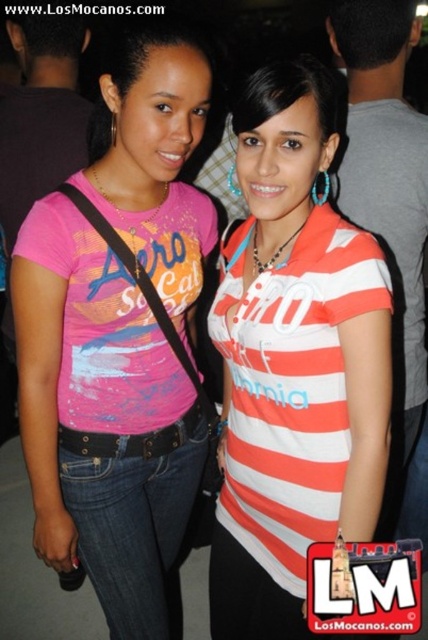
Question: Does pink matte t-shirt at center appear under striped cotton shirt at center?

Choices:
 (A) no
 (B) yes

Answer: (A)

Question: From the image, what is the correct spatial relationship of pink matte t-shirt at center in relation to striped cotton shirt at center?

Choices:
 (A) right
 (B) left

Answer: (B)

Question: Is pink matte t-shirt at center to the right of striped cotton shirt at center from the viewer's perspective?

Choices:
 (A) yes
 (B) no

Answer: (B)